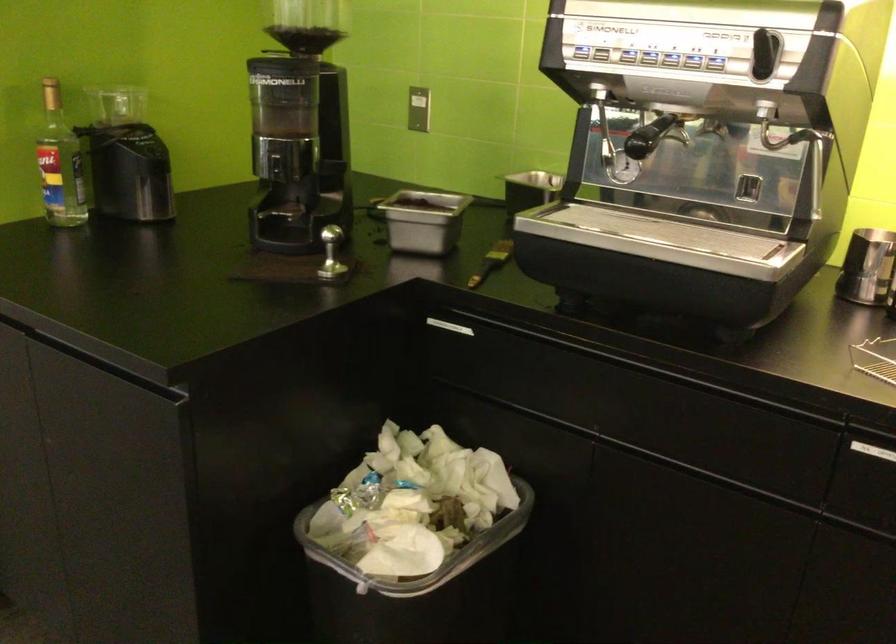
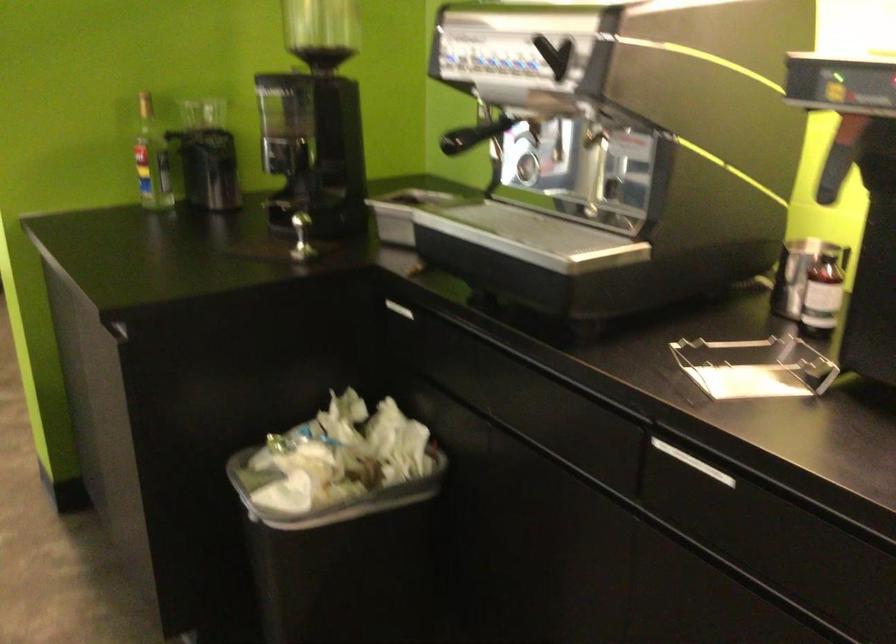
The point at (441, 325) is marked in the first image. Where is the corresponding point in the second image?

(394, 308)